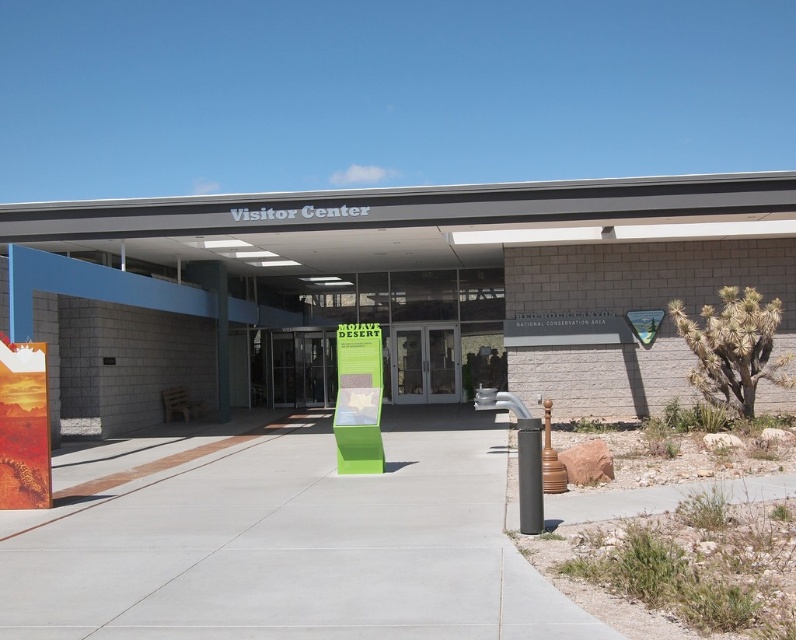
You are a tour guide leading a group to the entrance of the Visitor Center. You notice the gray concrete pavement at center and the clear glass doors at center. How far apart are these two features from each other?

The distance between the gray concrete pavement at center and the clear glass doors at center is 11.31 meters.

You are a visitor trying to enter the Visitor Center. You see the clear glass doors at center and the black smooth pole at lower right. Which object is wider?

The clear glass doors at center are wider than the black smooth pole at lower right.